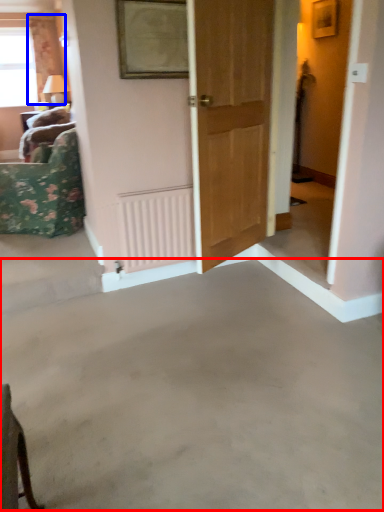
Question: Which of the following is the closest to the observer, concrete (highlighted by a red box) or curtain (highlighted by a blue box)?

Choices:
 (A) concrete
 (B) curtain

Answer: (A)